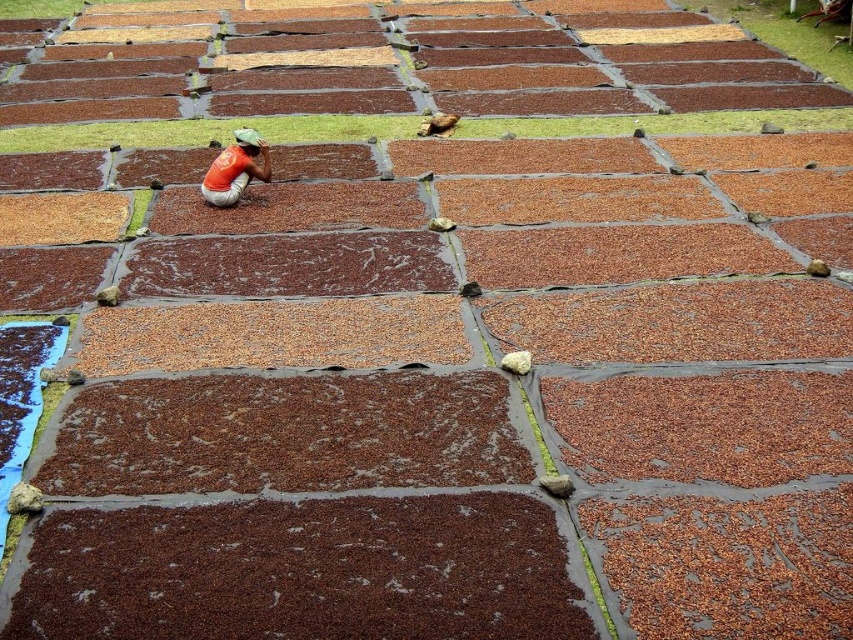
Question: Which point appears closest to the camera in this image?

Choices:
 (A) (242, 173)
 (B) (68, 600)

Answer: (B)

Question: Which point is closer to the camera taking this photo?

Choices:
 (A) (204, 568)
 (B) (239, 179)

Answer: (A)

Question: Does brown rough mud at bottom appear under orange fabric at center?

Choices:
 (A) yes
 (B) no

Answer: (A)

Question: Does brown rough mud at bottom appear under orange fabric at center?

Choices:
 (A) no
 (B) yes

Answer: (B)

Question: Can you confirm if brown rough mud at bottom is positioned above orange fabric at center?

Choices:
 (A) yes
 (B) no

Answer: (B)